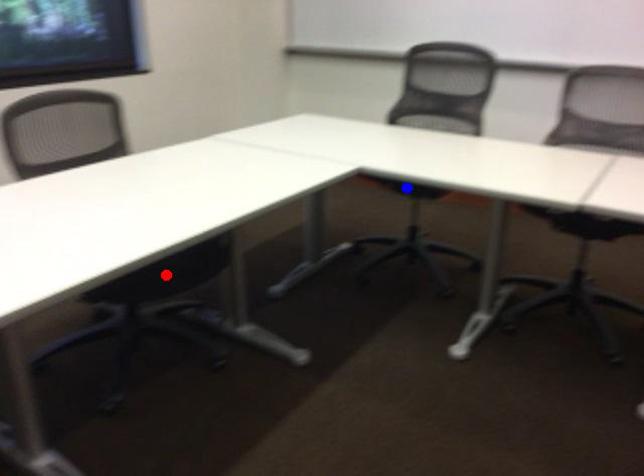
Question: In the image, two points are highlighted. Which point is nearer to the camera? Reply with the corresponding letter.

Choices:
 (A) blue point
 (B) red point

Answer: (B)